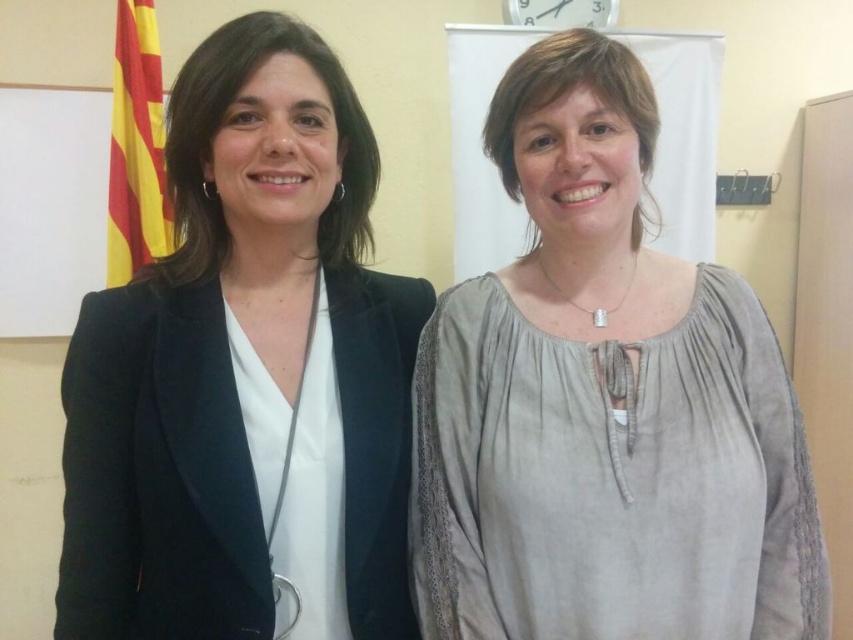
Does point (142, 392) come behind point (128, 179)?

No, it is not.

Is the position of matte black blazer at left more distant than that of yellowmaterial/textureflag at left?

No, it is not.

I want to click on matte black blazer at left, so click(x=247, y=372).

From the picture: Is light gray cotton blouse at center to the right of yellowmaterial/textureflag at left from the viewer's perspective?

Correct, you'll find light gray cotton blouse at center to the right of yellowmaterial/textureflag at left.

Based on the photo, between light gray cotton blouse at center and yellowmaterial/textureflag at left, which one is positioned lower?

Positioned lower is light gray cotton blouse at center.

Which is in front, point (691, 632) or point (119, 152)?

Point (691, 632)

Where is `light gray cotton blouse at center`? This screenshot has width=853, height=640. light gray cotton blouse at center is located at coordinates (604, 403).

Is point (567, 408) in front of point (105, 588)?

That is True.

You are a GUI agent. You are given a task and a screenshot of the screen. Output one action in this format:
    pyautogui.click(x=<x>, y=<y>)
    Task: Click on the light gray cotton blouse at center
    The height and width of the screenshot is (640, 853).
    Given the screenshot: What is the action you would take?
    pyautogui.click(x=604, y=403)

Locate an element on the screen. The image size is (853, 640). light gray cotton blouse at center is located at coordinates (604, 403).